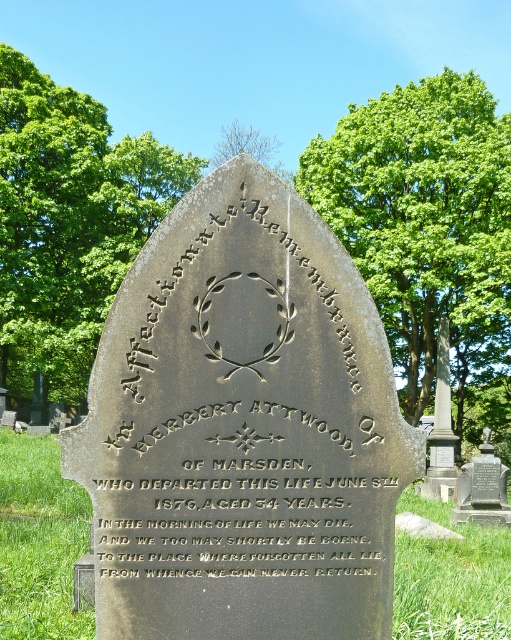
Is dark gray stone tombstone at center positioned behind green grass at lower center?

No.

Locate an element on the screen. Image resolution: width=511 pixels, height=640 pixels. dark gray stone tombstone at center is located at coordinates (243, 429).

Is green leafy tree at upper center positioned in front of green leafy tree at top?

Yes, green leafy tree at upper center is in front of green leafy tree at top.

Between point (496, 240) and point (223, 148), which one is positioned in front?

Point (496, 240)

Identify the location of green leafy tree at upper center. point(429,234).

Can you confirm if dark gray stone tombstone at center is bigger than green leafy tree at upper center?

Incorrect, dark gray stone tombstone at center is not larger than green leafy tree at upper center.

Consider the image. Is dark gray stone tombstone at center to the left of green leafy tree at upper center from the viewer's perspective?

Correct, you'll find dark gray stone tombstone at center to the left of green leafy tree at upper center.

You are a GUI agent. You are given a task and a screenshot of the screen. Output one action in this format:
    pyautogui.click(x=<x>, y=<y>)
    Task: Click on the dark gray stone tombstone at center
    Image resolution: width=511 pixels, height=640 pixels.
    Given the screenshot: What is the action you would take?
    pyautogui.click(x=243, y=429)